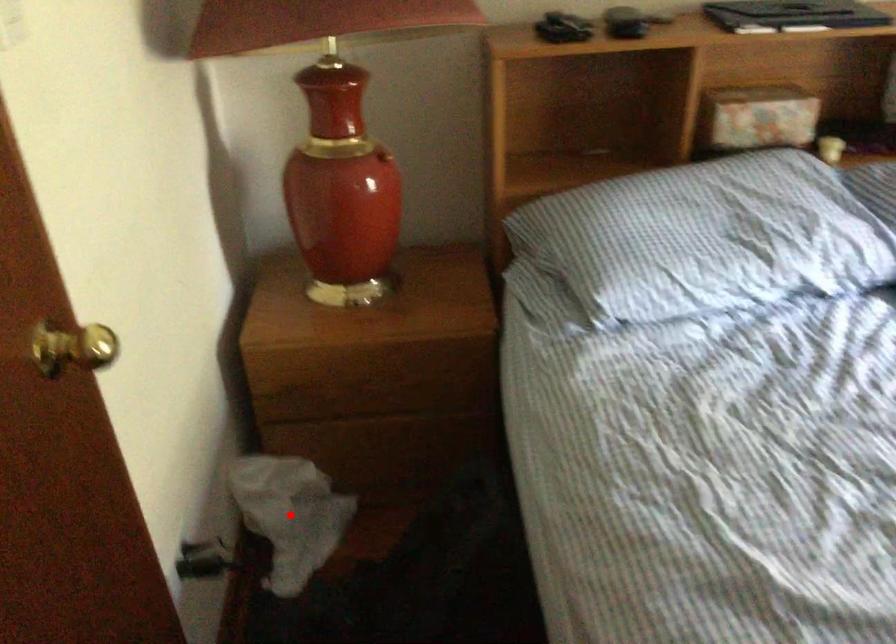
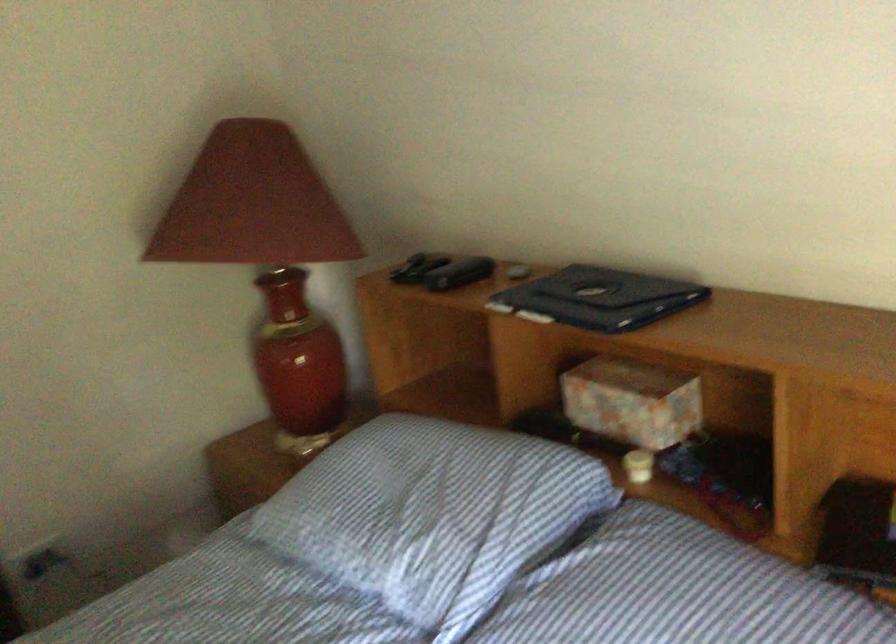
Question: I am providing you with two images of the same scene from different viewpoints. A red point is marked on the first image. Is the red point's position out of view in image 2?

Choices:
 (A) Yes
 (B) No

Answer: (A)